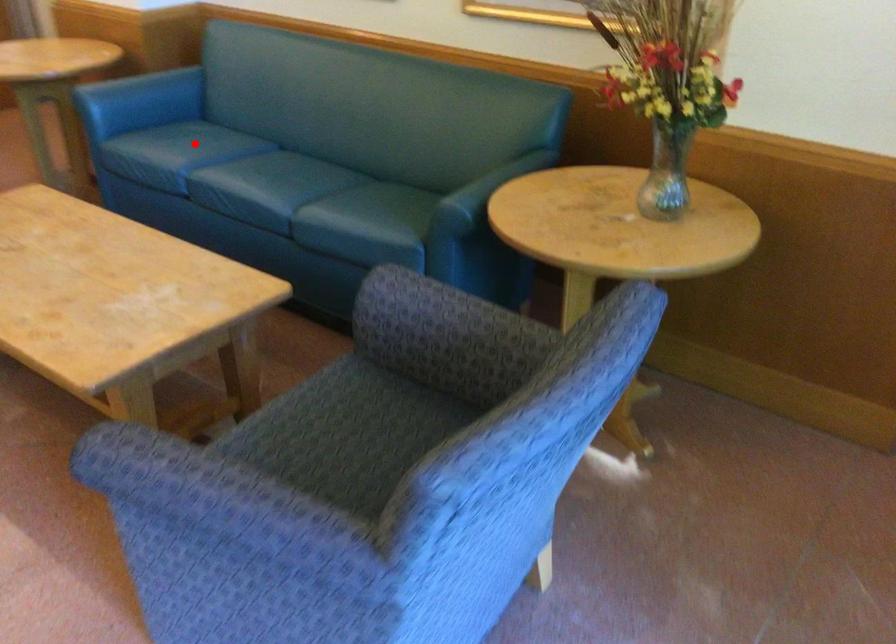
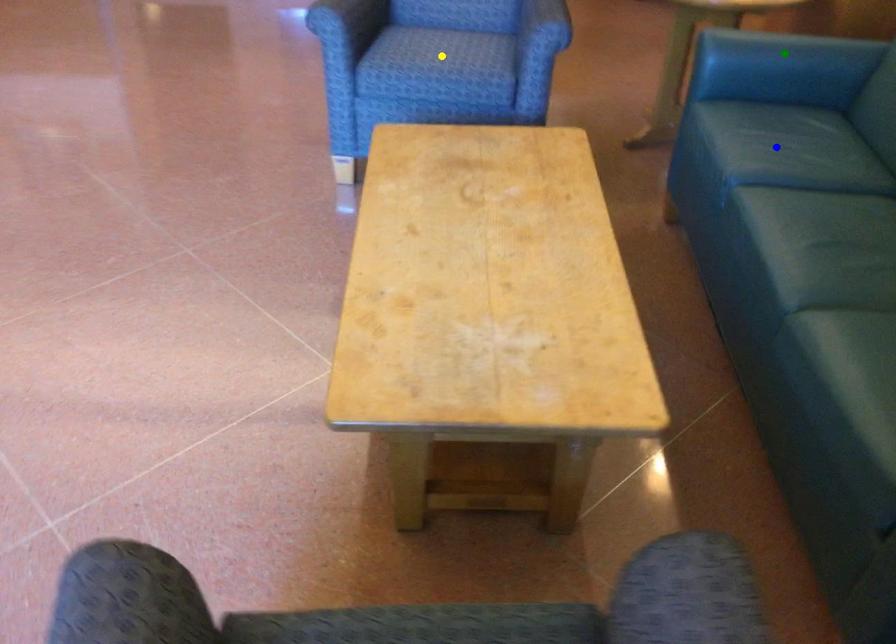
Question: I am providing you with two images of the same scene from different viewpoints. A red point is marked on the first image. You are given multiple points on the second image. Which point in image 2 is actually the same real-world point as the red point in image 1?

Choices:
 (A) blue point
 (B) green point
 (C) yellow point

Answer: (A)